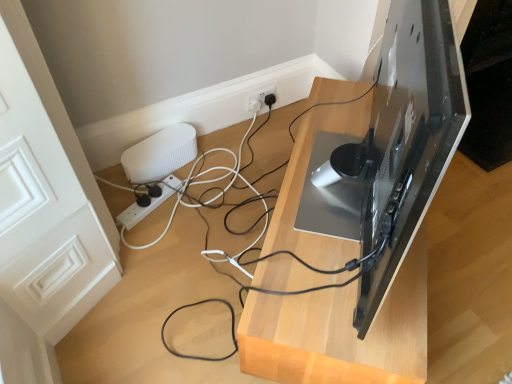
What are the coordinates of `free space between black glossy tv stand at upper right and white ribbed speaker at lower left` in the screenshot? It's located at (218, 210).